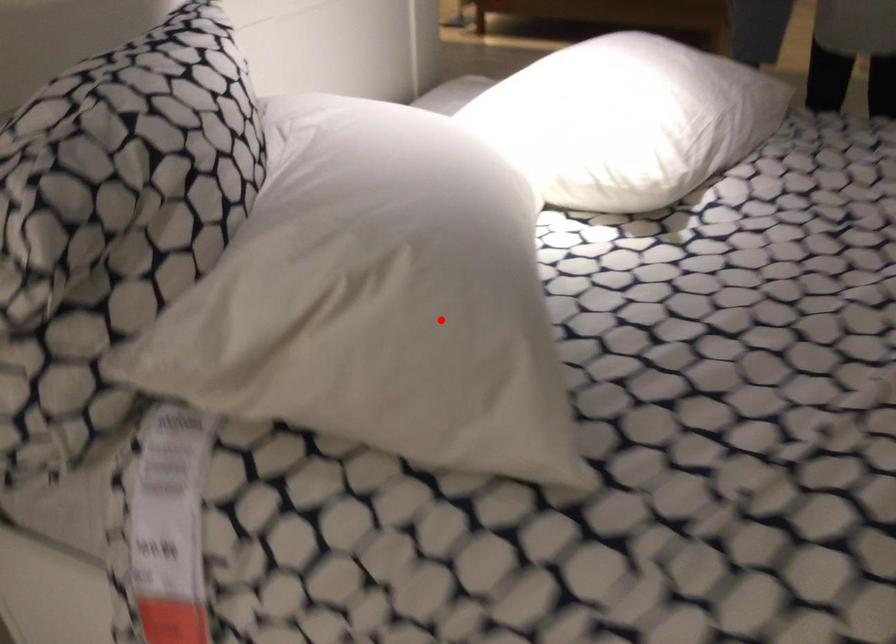
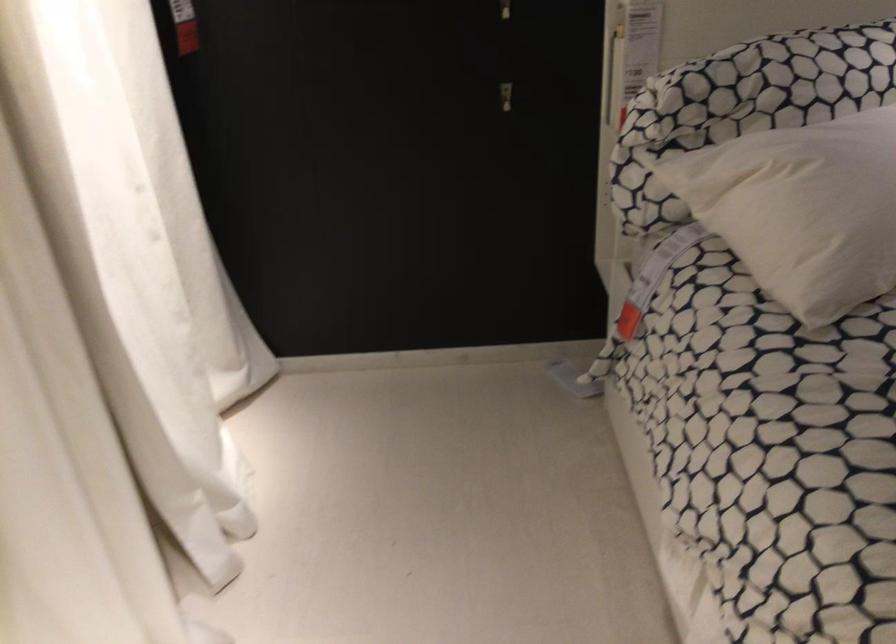
Locate, in the second image, the point that corresponds to the highlighted location in the first image.

(802, 209)